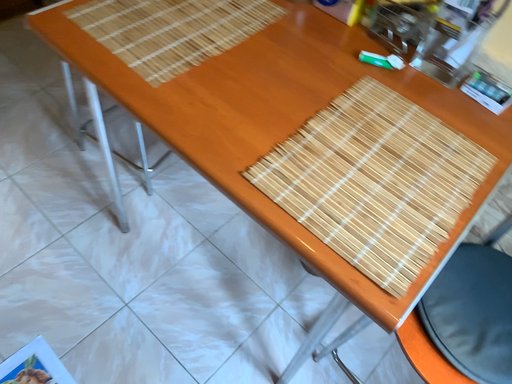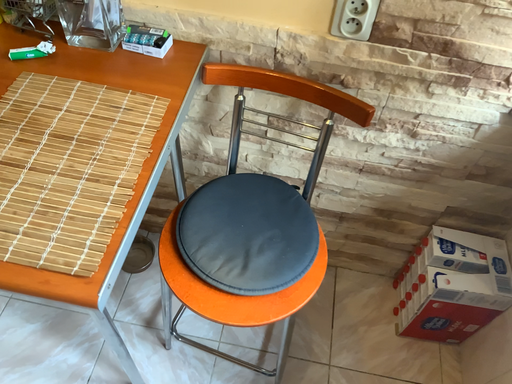
Question: Which way did the camera rotate in the video?

Choices:
 (A) rotated right
 (B) rotated left

Answer: (A)